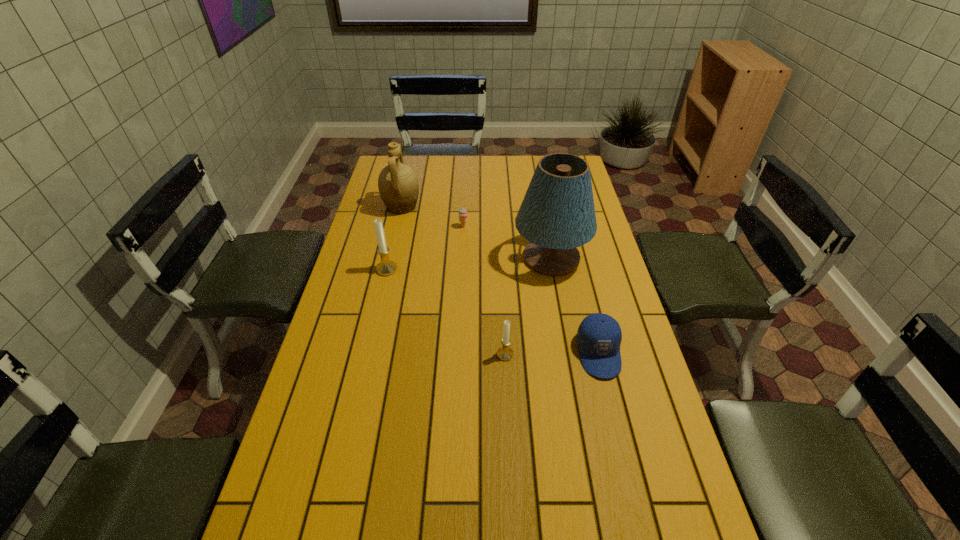
This screenshot has height=540, width=960. I want to click on the left candle holder, so click(386, 267).

Where is `the taller candle holder`? This screenshot has height=540, width=960. the taller candle holder is located at coordinates (386, 267).

Identify the location of the shorter candle holder. This screenshot has width=960, height=540. (505, 353).

Find the location of `the fourth object from left to right`. the fourth object from left to right is located at coordinates (505, 353).

At what (x,y) coordinates should I click in order to perform the action: click on the fifth shortest object. Please return your answer as a coordinate pair (x, y). Looking at the image, I should click on tap(398, 185).

This screenshot has height=540, width=960. Identify the location of pitcher. (398, 185).

The height and width of the screenshot is (540, 960). I want to click on sherbert, so click(x=463, y=214).

Identify the location of the second farthest object. The width and height of the screenshot is (960, 540). pos(463,214).

Where is `the tallest object`? The width and height of the screenshot is (960, 540). the tallest object is located at coordinates (557, 214).

The image size is (960, 540). I want to click on cap, so click(x=599, y=336).